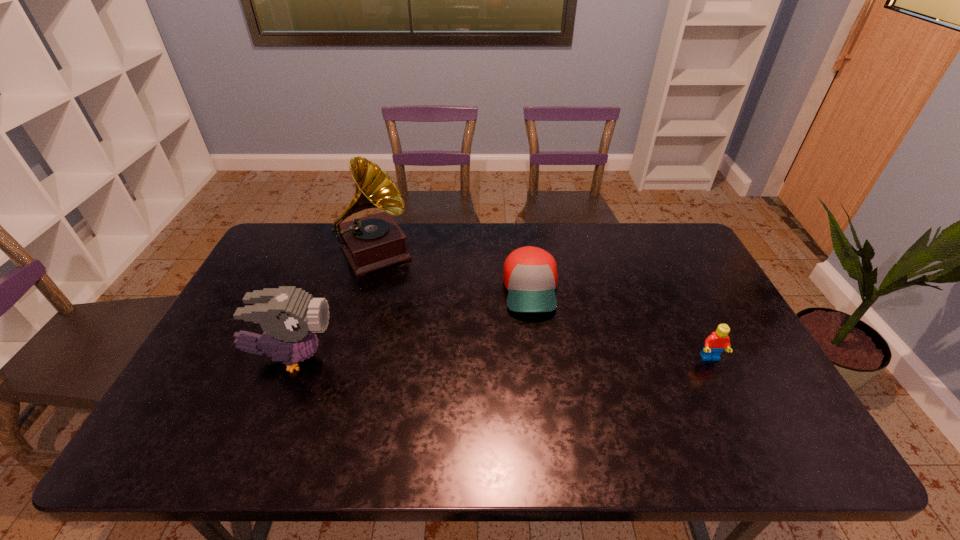
Where is `free space located 0.130m at the brim of the second object from right to left`? free space located 0.130m at the brim of the second object from right to left is located at coordinates (539, 356).

Find the location of `free space located at the brim of the second object from right to left`. free space located at the brim of the second object from right to left is located at coordinates (540, 363).

You are a GUI agent. You are given a task and a screenshot of the screen. Output one action in this format:
    pyautogui.click(x=<x>, y=<y>)
    Task: Click on the phonograph record that is positioned at the far edge
    
    Given the screenshot: What is the action you would take?
    pyautogui.click(x=372, y=242)

Locate an element on the screen. baseball cap that is at the far edge is located at coordinates (530, 275).

Find the location of a particular element. This screenshot has width=960, height=540. object situated at the left edge is located at coordinates (289, 316).

I want to click on object situated at the right edge, so click(715, 343).

The image size is (960, 540). What are the coordinates of `free space at the far edge` in the screenshot? It's located at (429, 235).

Image resolution: width=960 pixels, height=540 pixels. In the image, there is a desktop. What are the coordinates of `vacant space at the near edge` in the screenshot? It's located at click(288, 410).

In the image, there is a desktop. Find the location of `free space at the left edge`. free space at the left edge is located at coordinates (224, 320).

Where is `vacant space at the right edge of the desktop`? The image size is (960, 540). vacant space at the right edge of the desktop is located at coordinates (681, 283).